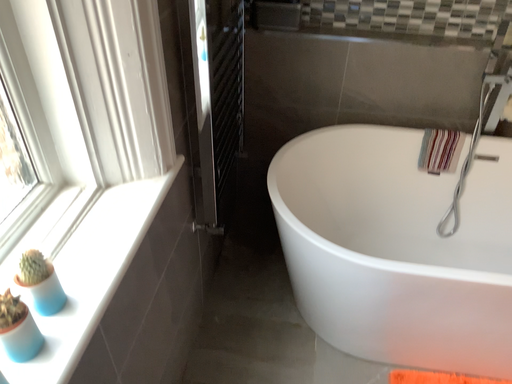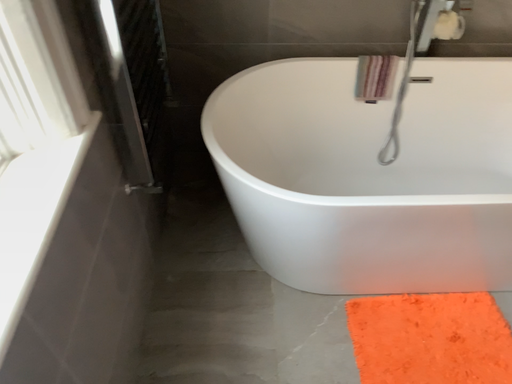
Question: Which way did the camera rotate in the video?

Choices:
 (A) rotated right
 (B) rotated left

Answer: (A)